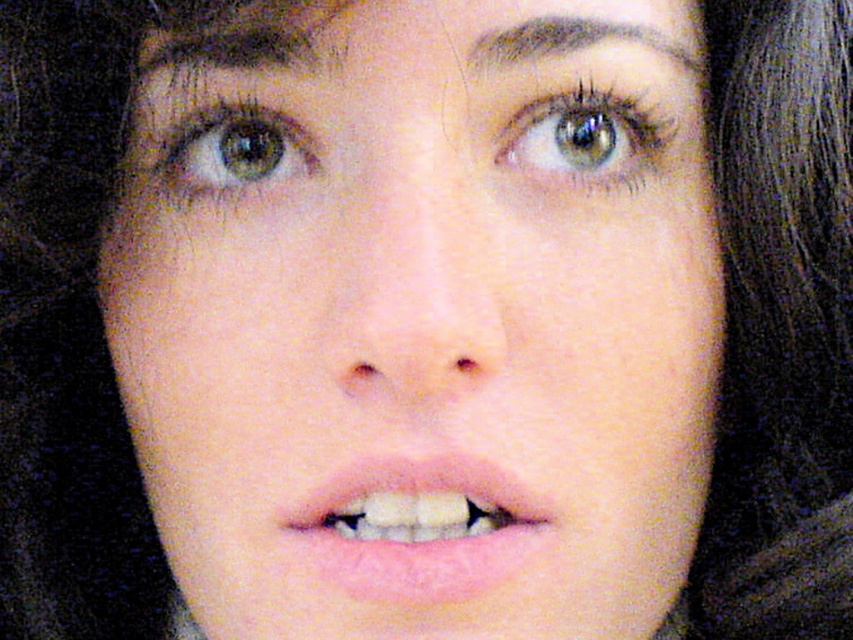
Question: Is the position of pink matte lips at center more distant than that of brown hair at upper center?

Choices:
 (A) yes
 (B) no

Answer: (B)

Question: Considering the relative positions of pink matte lips at center and brown hair at upper center in the image provided, where is pink matte lips at center located with respect to brown hair at upper center?

Choices:
 (A) above
 (B) below

Answer: (B)

Question: Which object is positioned farthest from the pink matte lips at center?

Choices:
 (A) green matte eye at upper left
 (B) green matte eye at upper center
 (C) brown hair at upper center

Answer: (C)

Question: Which object appears farthest from the camera in this image?

Choices:
 (A) pink matte lips at center
 (B) brown hair at upper center
 (C) green matte eye at upper left

Answer: (C)

Question: Estimate the real-world distances between objects in this image. Which object is closer to the green matte eye at upper left?

Choices:
 (A) green matte eye at upper center
 (B) pink matte lips at center

Answer: (A)

Question: Is green matte eye at upper center smaller than green matte eye at upper left?

Choices:
 (A) yes
 (B) no

Answer: (B)